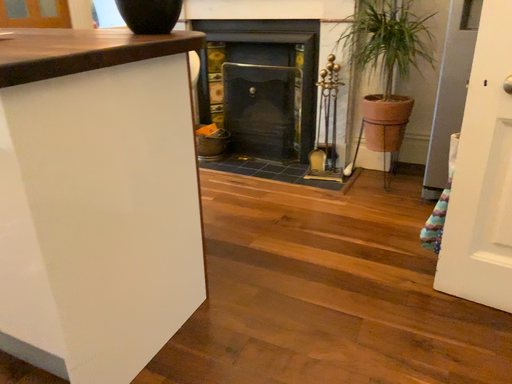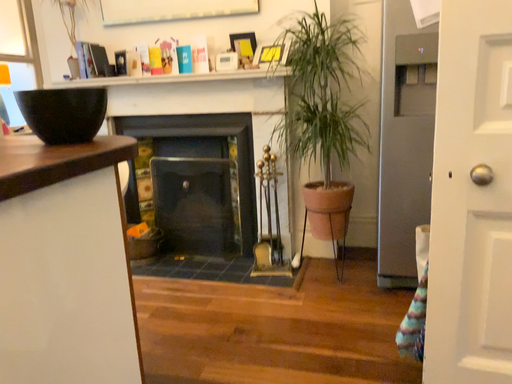
Question: Which way did the camera rotate in the video?

Choices:
 (A) rotated left
 (B) rotated right

Answer: (B)